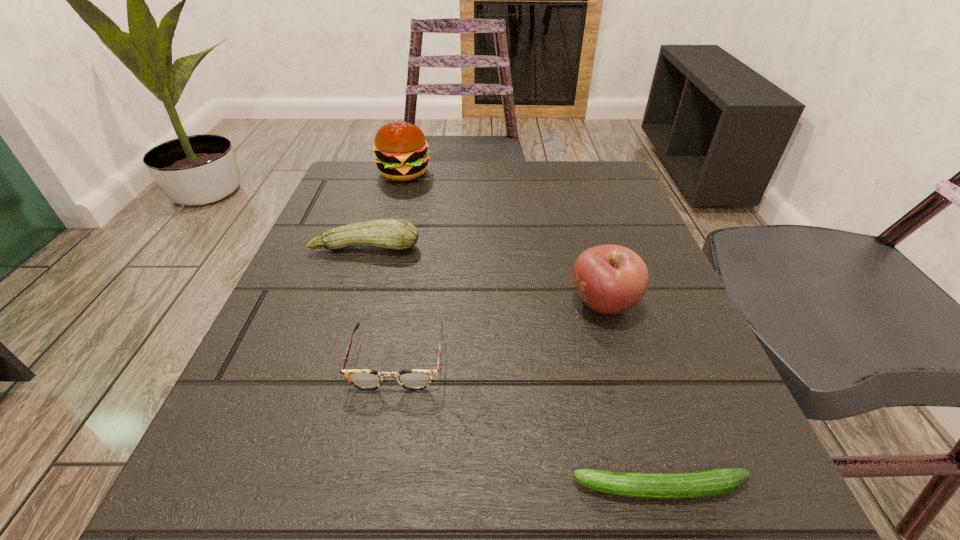
The width and height of the screenshot is (960, 540). Identify the location of vacant space at the left edge of the desktop. (352, 288).

The width and height of the screenshot is (960, 540). I want to click on free space at the right edge, so click(568, 240).

At what (x,y) coordinates should I click in order to perform the action: click on vacant area at the far left corner. Please return your answer as a coordinate pair (x, y). The image size is (960, 540). Looking at the image, I should click on (352, 160).

I want to click on vacant space at the far right corner of the desktop, so click(x=578, y=208).

Where is `free space between the fourth nearest object and the spectacles`? This screenshot has width=960, height=540. free space between the fourth nearest object and the spectacles is located at coordinates [381, 303].

The width and height of the screenshot is (960, 540). In order to click on unoccupied position between the second nearest object and the second farthest object in this screenshot , I will do `click(381, 303)`.

Where is `unoccupied position between the farther zucchini and the shorter zucchini`? The height and width of the screenshot is (540, 960). unoccupied position between the farther zucchini and the shorter zucchini is located at coordinates (513, 367).

The width and height of the screenshot is (960, 540). What are the coordinates of `unoccupied area between the third tallest object and the second shortest object` in the screenshot? It's located at (381, 303).

Where is `vacant space that is in between the third shortest object and the second shortest object`? The height and width of the screenshot is (540, 960). vacant space that is in between the third shortest object and the second shortest object is located at coordinates (381, 303).

This screenshot has width=960, height=540. In order to click on free spot between the third farthest object and the second shortest object in this screenshot , I will do `click(500, 332)`.